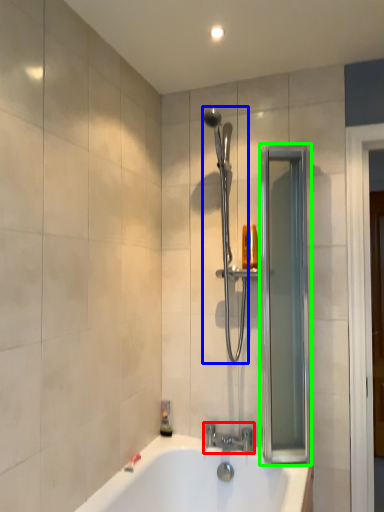
Question: Estimate the real-world distances between objects in this image. Which object is closer to tap (highlighted by a red box), shower (highlighted by a blue box) or screen door (highlighted by a green box)?

Choices:
 (A) shower
 (B) screen door

Answer: (B)